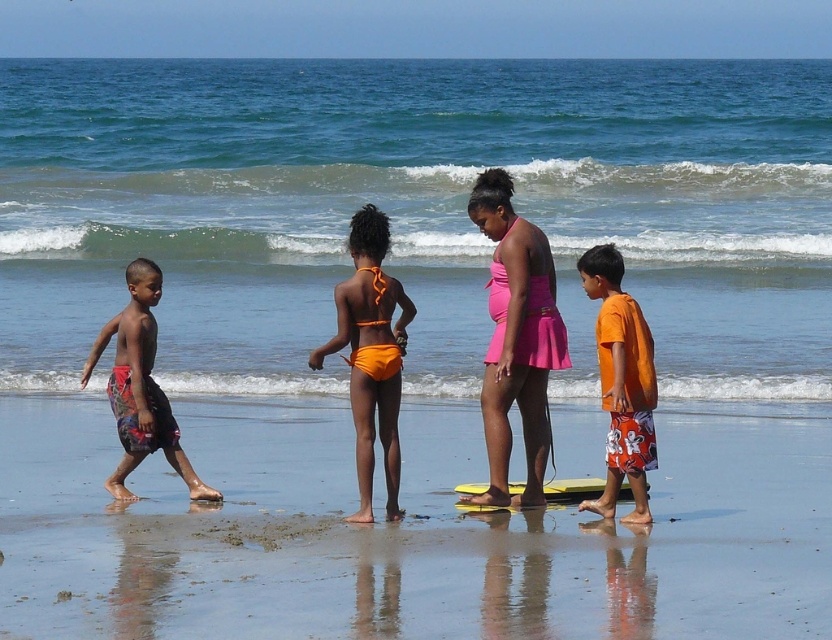
Question: Which object is closer to the camera taking this photo?

Choices:
 (A) orange printed shorts at right
 (B) yellow foam surfboard at center
 (C) smooth sand at lower center
 (D) multicolored printed shorts at left

Answer: (C)

Question: Which point is farther to the camera?

Choices:
 (A) (641, 634)
 (B) (156, 326)

Answer: (B)

Question: Which point is farther from the camera taking this photo?

Choices:
 (A) (533, 268)
 (B) (471, 484)

Answer: (B)

Question: Can you confirm if smooth sand at lower center is wider than orange fabric bikini at center?

Choices:
 (A) no
 (B) yes

Answer: (B)

Question: Does smooth sand at lower center appear under orange fabric bikini at center?

Choices:
 (A) yes
 (B) no

Answer: (A)

Question: Does smooth sand at lower center have a greater width compared to orange printed shorts at right?

Choices:
 (A) no
 (B) yes

Answer: (B)